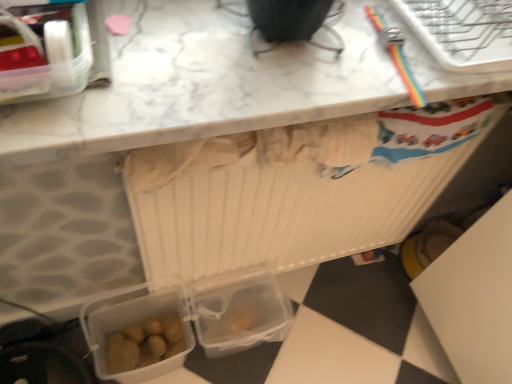
This screenshot has width=512, height=384. In order to click on free space to the right of translucent plastic lunch box at upper left, which is counted as the first lunch box, starting from the top in this screenshot , I will do `click(178, 64)`.